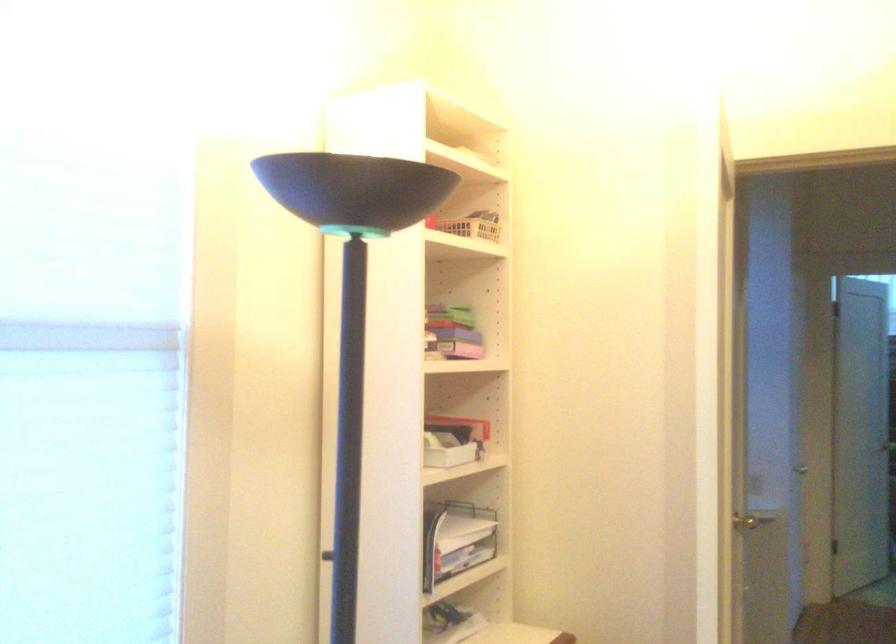
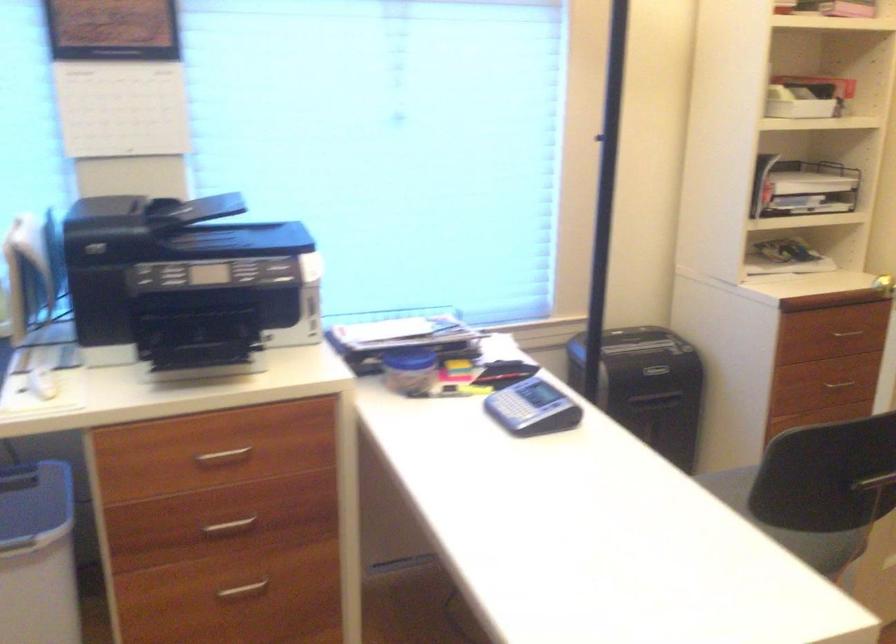
The images are taken continuously from a first-person perspective. In which direction is your viewpoint rotating?

The camera's rotation is toward left-down.